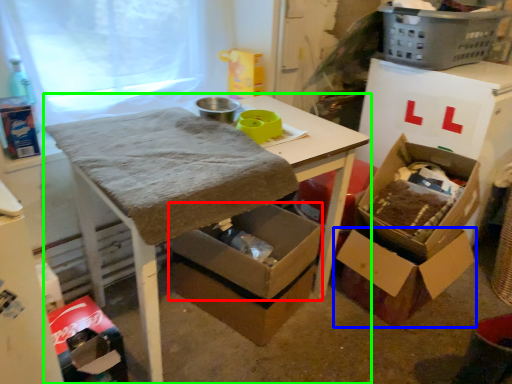
Question: Based on their relative distances, which object is nearer to box (highlighted by a red box)? Choose from box (highlighted by a blue box) and table (highlighted by a green box).

Choices:
 (A) box
 (B) table

Answer: (B)